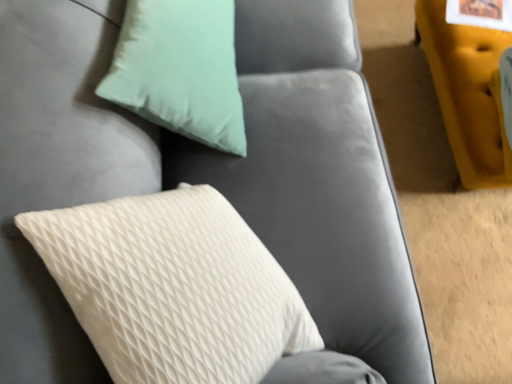
This screenshot has width=512, height=384. I want to click on velvet mustard armchair at right, so click(468, 93).

This screenshot has width=512, height=384. Describe the element at coordinates (468, 93) in the screenshot. I see `velvet mustard armchair at right` at that location.

Image resolution: width=512 pixels, height=384 pixels. I want to click on velvet mustard armchair at right, so click(x=468, y=93).